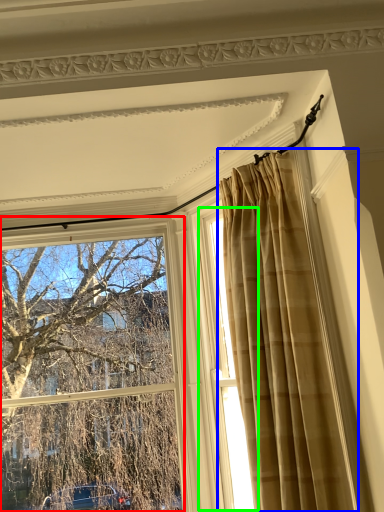
Question: Which object is positioned closest to window (highlighted by a red box)? Select from curtain (highlighted by a blue box) and window (highlighted by a green box).

Choices:
 (A) curtain
 (B) window

Answer: (B)